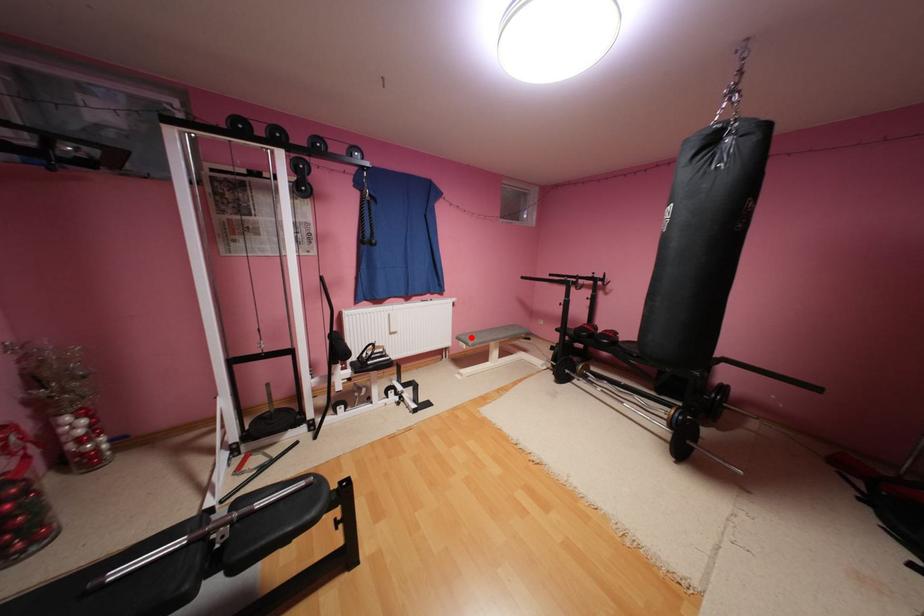
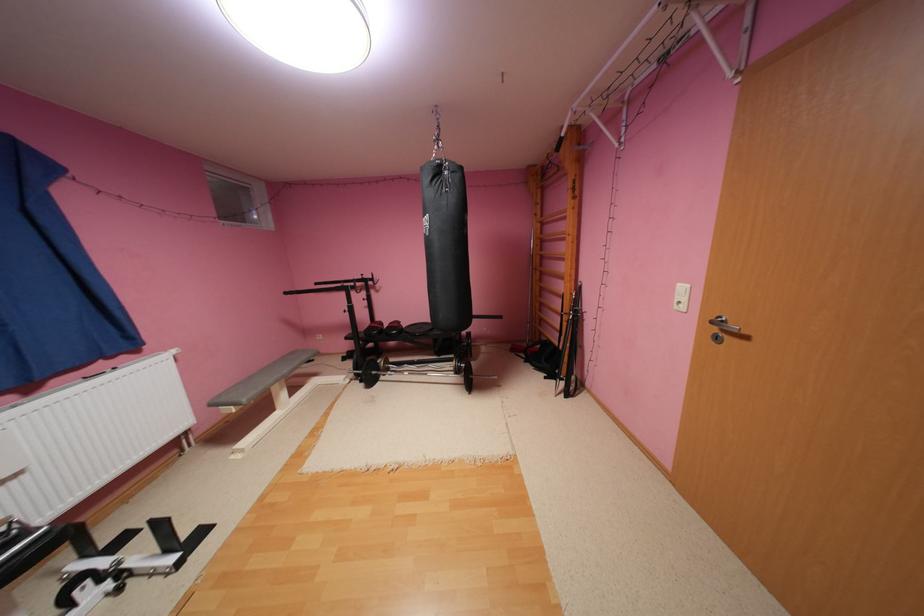
Find the pixel in the second image that matches the highlighted location in the first image.

(233, 399)